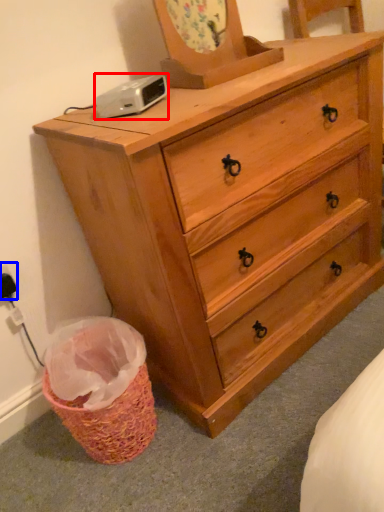
Question: Among these objects, which one is nearest to the camera, gadget (highlighted by a red box) or electric outlet (highlighted by a blue box)?

Choices:
 (A) gadget
 (B) electric outlet

Answer: (A)